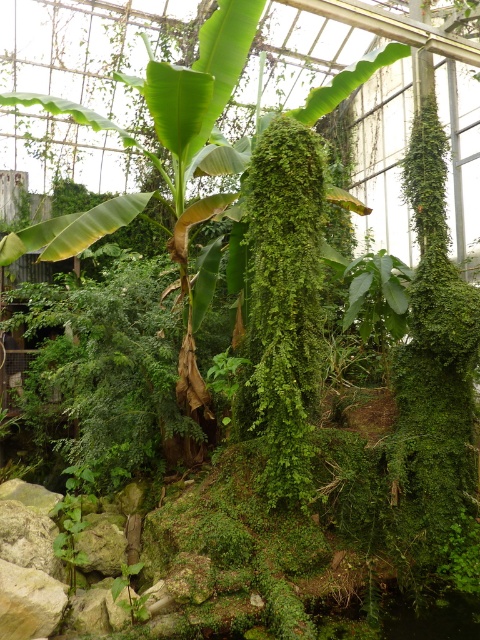
Question: Is green leafy banana tree at center in front of green fuzzy fern at center?

Choices:
 (A) no
 (B) yes

Answer: (B)

Question: Which object appears farthest from the camera in this image?

Choices:
 (A) green fuzzy fern at center
 (B) green leafy banana tree at center

Answer: (A)

Question: Can you confirm if green leafy banana tree at center is positioned below green fuzzy fern at center?

Choices:
 (A) yes
 (B) no

Answer: (B)

Question: Is green leafy banana tree at center thinner than green fuzzy fern at center?

Choices:
 (A) no
 (B) yes

Answer: (A)